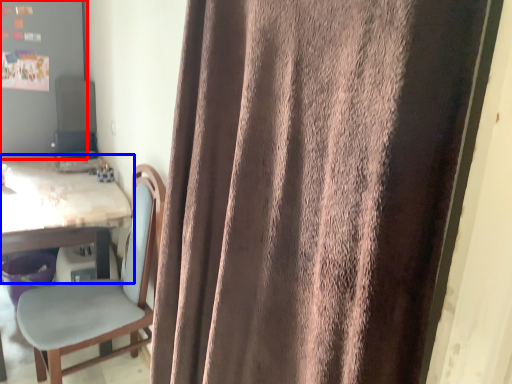
Question: Which point is further to the camera, bulletin board (highlighted by a red box) or table (highlighted by a blue box)?

Choices:
 (A) bulletin board
 (B) table

Answer: (A)